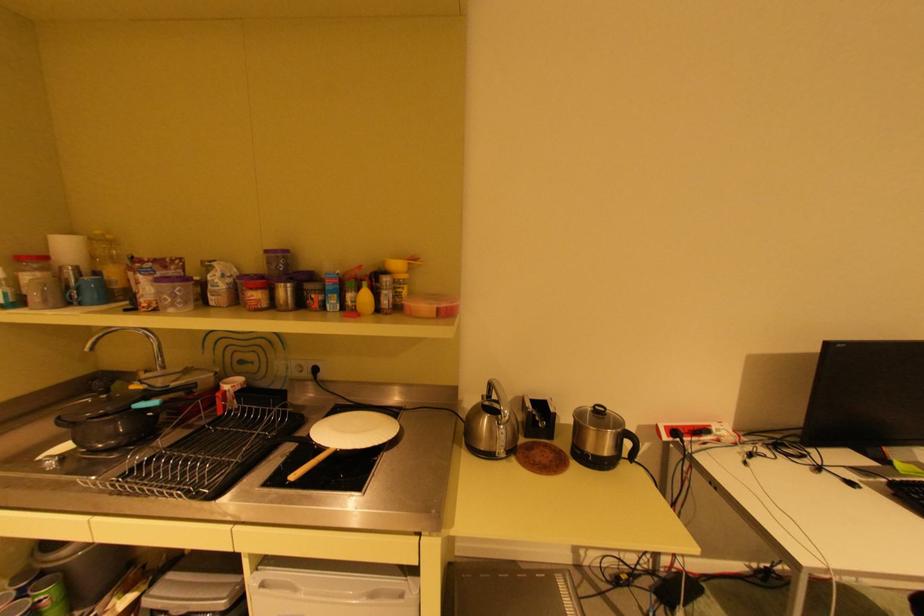
The width and height of the screenshot is (924, 616). What do you see at coordinates (497, 403) in the screenshot?
I see `a silver kettle handle` at bounding box center [497, 403].